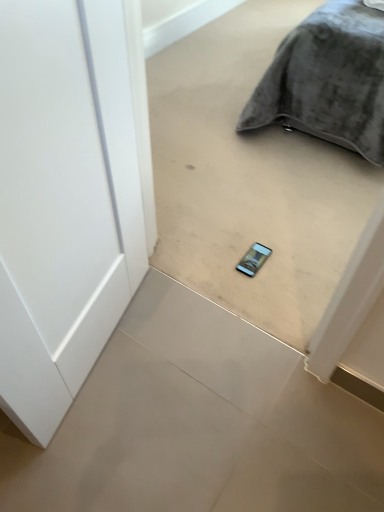
Question: Is the position of matte gray phone at center, acting as the second concrete starting from the bottom, less distant than that of velvet gray pillow at upper right?

Choices:
 (A) no
 (B) yes

Answer: (B)

Question: Can you confirm if matte gray phone at center, acting as the second concrete starting from the bottom, is taller than velvet gray pillow at upper right?

Choices:
 (A) yes
 (B) no

Answer: (A)

Question: Considering the relative sizes of matte gray phone at center, which is counted as the first concrete, starting from the top, and velvet gray pillow at upper right in the image provided, is matte gray phone at center, which is counted as the first concrete, starting from the top, bigger than velvet gray pillow at upper right?

Choices:
 (A) no
 (B) yes

Answer: (A)

Question: Is matte gray phone at center, which is counted as the first concrete, starting from the top, wider than velvet gray pillow at upper right?

Choices:
 (A) yes
 (B) no

Answer: (B)

Question: Are matte gray phone at center, acting as the second concrete starting from the bottom, and velvet gray pillow at upper right beside each other?

Choices:
 (A) no
 (B) yes

Answer: (A)

Question: Is matte gray phone at center, which is counted as the first concrete, starting from the top, shorter than velvet gray pillow at upper right?

Choices:
 (A) yes
 (B) no

Answer: (B)

Question: Is white glossy concrete at center, placed as the first concrete when sorted from bottom to top, at the left side of velvet gray pillow at upper right?

Choices:
 (A) no
 (B) yes

Answer: (B)

Question: Is white glossy concrete at center, placed as the first concrete when sorted from bottom to top, not inside velvet gray pillow at upper right?

Choices:
 (A) yes
 (B) no

Answer: (A)

Question: Could you tell me if white glossy concrete at center, placed as the first concrete when sorted from bottom to top, is facing velvet gray pillow at upper right?

Choices:
 (A) yes
 (B) no

Answer: (B)

Question: Is white glossy concrete at center, placed as the first concrete when sorted from bottom to top, positioned in front of velvet gray pillow at upper right?

Choices:
 (A) no
 (B) yes

Answer: (B)

Question: From the image's perspective, is white glossy concrete at center, placed as the first concrete when sorted from bottom to top, above velvet gray pillow at upper right?

Choices:
 (A) no
 (B) yes

Answer: (A)

Question: Is white glossy concrete at center, the second concrete positioned from the top, next to velvet gray pillow at upper right?

Choices:
 (A) no
 (B) yes

Answer: (A)

Question: Is matte gray phone at center, acting as the second concrete starting from the bottom, a part of white glossy concrete at center, placed as the first concrete when sorted from bottom to top?

Choices:
 (A) yes
 (B) no

Answer: (B)